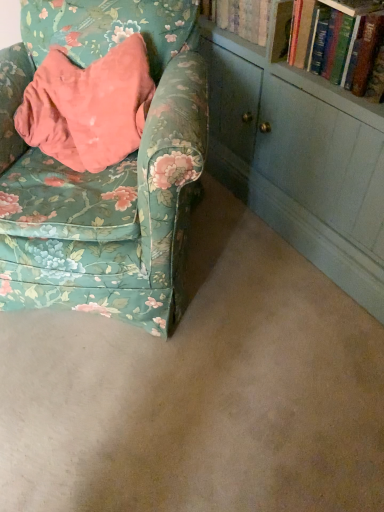
What is the approximate width of floral fabric chair at left?

floral fabric chair at left is 1.01 meters wide.

Image resolution: width=384 pixels, height=512 pixels. What do you see at coordinates (104, 172) in the screenshot?
I see `floral fabric chair at left` at bounding box center [104, 172].

You are a GUI agent. You are given a task and a screenshot of the screen. Output one action in this format:
    pyautogui.click(x=<x>, y=<y>)
    Task: Click on the floral fabric chair at left
    Image resolution: width=384 pixels, height=512 pixels.
    Given the screenshot: What is the action you would take?
    pyautogui.click(x=104, y=172)

What are the coordinates of `hardcover book at upper right` in the screenshot? It's located at (334, 36).

What do you see at coordinates (334, 36) in the screenshot? The width and height of the screenshot is (384, 512). I see `hardcover book at upper right` at bounding box center [334, 36].

You are a GUI agent. You are given a task and a screenshot of the screen. Output one action in this format:
    pyautogui.click(x=<x>, y=<y>)
    Task: Click on the floral fabric chair at left
    
    Given the screenshot: What is the action you would take?
    pyautogui.click(x=104, y=172)

Is hardcover book at upper right at the left side of floral fabric chair at left?

Incorrect, hardcover book at upper right is not on the left side of floral fabric chair at left.

Is the position of hardcover book at upper right less distant than that of floral fabric chair at left?

No, hardcover book at upper right is further to the viewer.

Is point (348, 32) less distant than point (142, 192)?

No, (348, 32) is further to viewer.

From the image's perspective, is hardcover book at upper right above floral fabric chair at left?

Yes, from the image's perspective, hardcover book at upper right is over floral fabric chair at left.

From a real-world perspective, is hardcover book at upper right below floral fabric chair at left?

Actually, hardcover book at upper right is physically above floral fabric chair at left in the real world.

Which of these two, hardcover book at upper right or floral fabric chair at left, is wider?

floral fabric chair at left.

Considering the sizes of objects hardcover book at upper right and floral fabric chair at left in the image provided, who is taller, hardcover book at upper right or floral fabric chair at left?

Standing taller between the two is floral fabric chair at left.

Consider the image. Can you confirm if hardcover book at upper right is smaller than floral fabric chair at left?

Yes.

Is floral fabric chair at left a part of hardcover book at upper right?

No, floral fabric chair at left is not inside hardcover book at upper right.

Is hardcover book at upper right far away from floral fabric chair at left?

hardcover book at upper right is actually quite close to floral fabric chair at left.

Does hardcover book at upper right turn towards floral fabric chair at left?

Yes, hardcover book at upper right is turned towards floral fabric chair at left.

The height and width of the screenshot is (512, 384). I want to click on book that appears above the floral fabric chair at left (from the image's perspective), so click(x=334, y=36).

Between floral fabric chair at left and hardcover book at upper right, which one appears on the left side from the viewer's perspective?

floral fabric chair at left is more to the left.

Is floral fabric chair at left in front of or behind hardcover book at upper right in the image?

floral fabric chair at left is positioned closer to the viewer than hardcover book at upper right.

Does point (140, 147) come in front of point (295, 25)?

Yes, it is in front of point (295, 25).

From the image's perspective, is floral fabric chair at left beneath hardcover book at upper right?

Yes, from the image's perspective, floral fabric chair at left is beneath hardcover book at upper right.

From a real-world perspective, is floral fabric chair at left above or below hardcover book at upper right?

Clearly, from a real-world perspective, floral fabric chair at left is below hardcover book at upper right.

Considering the sizes of objects floral fabric chair at left and hardcover book at upper right in the image provided, who is wider, floral fabric chair at left or hardcover book at upper right?

Wider between the two is floral fabric chair at left.

Considering the sizes of objects floral fabric chair at left and hardcover book at upper right in the image provided, who is taller, floral fabric chair at left or hardcover book at upper right?

Standing taller between the two is floral fabric chair at left.

Does floral fabric chair at left have a smaller size compared to hardcover book at upper right?

Incorrect, floral fabric chair at left is not smaller in size than hardcover book at upper right.

Is hardcover book at upper right a part of floral fabric chair at left?

No, hardcover book at upper right is located outside of floral fabric chair at left.

Is floral fabric chair at left directly adjacent to hardcover book at upper right?

No.

Is floral fabric chair at left looking in the opposite direction of hardcover book at upper right?

floral fabric chair at left is not turned away from hardcover book at upper right.

How distant is floral fabric chair at left from hardcover book at upper right?

24.35 inches.

At what (x,y) coordinates should I click in order to perform the action: click on chair on the left of hardcover book at upper right. Please return your answer as a coordinate pair (x, y). The width and height of the screenshot is (384, 512). Looking at the image, I should click on (104, 172).

Find the location of a particular element. book that appears above the floral fabric chair at left (from a real-world perspective) is located at coordinates (334, 36).

This screenshot has width=384, height=512. Identify the location of book lying behind the floral fabric chair at left. (334, 36).